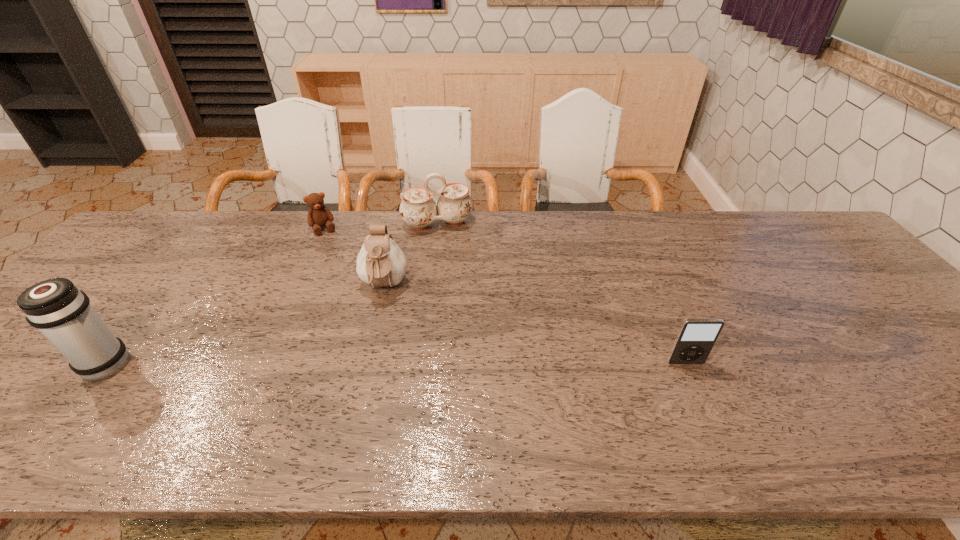
This screenshot has height=540, width=960. What are the coordinates of `free space between the pouch and the chinaware` in the screenshot? It's located at pyautogui.click(x=411, y=255).

Identify the location of free area in between the leftmost object and the second shortest object. This screenshot has height=540, width=960. (394, 364).

The image size is (960, 540). What are the coordinates of `free area in between the leftmost object and the shortest object` in the screenshot? It's located at (213, 297).

Locate an element on the screen. free point between the pouch and the tallest object is located at coordinates (243, 326).

At what (x,y) coordinates should I click in order to perform the action: click on free space between the iPod and the leftmost object. Please return your answer as a coordinate pair (x, y). Image resolution: width=960 pixels, height=540 pixels. Looking at the image, I should click on (394, 364).

This screenshot has width=960, height=540. What are the coordinates of `vacant space that is in between the tallest object and the pouch` in the screenshot? It's located at (243, 326).

You are a GUI agent. You are given a task and a screenshot of the screen. Output one action in this format:
    pyautogui.click(x=<x>, y=<y>)
    Task: Click on the vacant area that lies between the fourth tallest object and the thermos bottle
    
    Given the screenshot: What is the action you would take?
    pyautogui.click(x=394, y=364)

Identify the location of free space between the leftmost object and the third farthest object. (243, 326).

Locate an element on the screen. vacant area that lies between the teddy bear and the fourth tallest object is located at coordinates (505, 296).

Identify the location of object that can be found as the third closest to the thermos bottle. Image resolution: width=960 pixels, height=540 pixels. (418, 209).